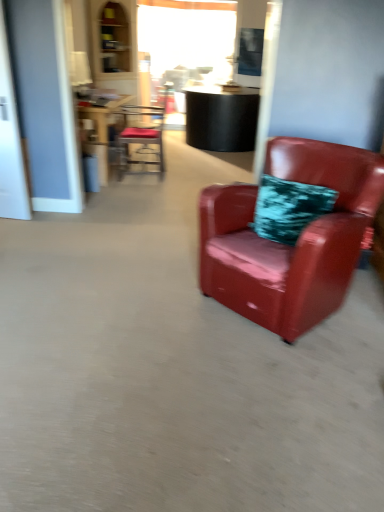
Question: From the image's perspective, is wooden table at center located above transparent glass door at left?

Choices:
 (A) no
 (B) yes

Answer: (B)

Question: Is wooden table at center oriented towards transparent glass door at left?

Choices:
 (A) no
 (B) yes

Answer: (A)

Question: Can you see wooden table at center touching transparent glass door at left?

Choices:
 (A) yes
 (B) no

Answer: (B)

Question: Does wooden table at center have a smaller size compared to transparent glass door at left?

Choices:
 (A) yes
 (B) no

Answer: (B)

Question: From the image's perspective, would you say wooden table at center is shown under transparent glass door at left?

Choices:
 (A) no
 (B) yes

Answer: (A)

Question: From their relative heights in the image, would you say metallic red chair at upper center, the second chair from the bottom, is taller or shorter than transparent glass door at left?

Choices:
 (A) short
 (B) tall

Answer: (A)

Question: Based on their positions, is metallic red chair at upper center, which appears as the 1th chair when viewed from the left, located to the left or right of transparent glass door at left?

Choices:
 (A) left
 (B) right

Answer: (B)

Question: Is metallic red chair at upper center, which ranks as the 1th chair in top-to-bottom order, in front of or behind transparent glass door at left in the image?

Choices:
 (A) front
 (B) behind

Answer: (B)

Question: From the image's perspective, is metallic red chair at upper center, which is counted as the first chair, starting from the back, positioned above or below transparent glass door at left?

Choices:
 (A) below
 (B) above

Answer: (B)

Question: Considering their positions, is transparent glass door at left located in front of or behind glossy leather armchair at right, which is the second chair from top to bottom?

Choices:
 (A) behind
 (B) front

Answer: (A)

Question: Would you say transparent glass door at left is inside or outside glossy leather armchair at right, acting as the 1th chair starting from the front?

Choices:
 (A) outside
 (B) inside

Answer: (A)

Question: From a real-world perspective, relative to glossy leather armchair at right, acting as the 1th chair starting from the front, is transparent glass door at left vertically above or below?

Choices:
 (A) below
 (B) above

Answer: (B)

Question: From their relative heights in the image, would you say transparent glass door at left is taller or shorter than glossy leather armchair at right, positioned as the first chair in right-to-left order?

Choices:
 (A) short
 (B) tall

Answer: (B)

Question: In terms of width, does glossy leather armchair at right, which is the second chair from top to bottom, look wider or thinner when compared to metallic red chair at upper center, which is counted as the first chair, starting from the back?

Choices:
 (A) wide
 (B) thin

Answer: (A)

Question: From their relative heights in the image, would you say glossy leather armchair at right, the second chair in the back-to-front sequence, is taller or shorter than metallic red chair at upper center, which is counted as the second chair, starting from the front?

Choices:
 (A) tall
 (B) short

Answer: (B)